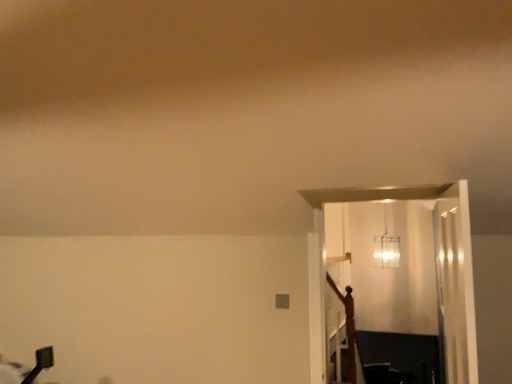
Question: Can we say wooden crucifix at right lies outside clear glass door at right?

Choices:
 (A) yes
 (B) no

Answer: (A)

Question: From a real-world perspective, is wooden crucifix at right beneath clear glass door at right?

Choices:
 (A) no
 (B) yes

Answer: (B)

Question: Can you confirm if wooden crucifix at right is taller than clear glass door at right?

Choices:
 (A) no
 (B) yes

Answer: (B)

Question: Does wooden crucifix at right have a smaller size compared to clear glass door at right?

Choices:
 (A) no
 (B) yes

Answer: (B)

Question: From a real-world perspective, is wooden crucifix at right positioned over clear glass door at right based on gravity?

Choices:
 (A) no
 (B) yes

Answer: (A)

Question: Is wooden crucifix at right far away from clear glass door at right?

Choices:
 (A) yes
 (B) no

Answer: (B)

Question: Does wooden crucifix at right appear on the right side of translucent glass pendant light at upper center?

Choices:
 (A) no
 (B) yes

Answer: (A)

Question: From a real-world perspective, does wooden crucifix at right stand above translucent glass pendant light at upper center?

Choices:
 (A) no
 (B) yes

Answer: (A)

Question: Is wooden crucifix at right turned away from translucent glass pendant light at upper center?

Choices:
 (A) yes
 (B) no

Answer: (B)

Question: Is wooden crucifix at right wider than translucent glass pendant light at upper center?

Choices:
 (A) yes
 (B) no

Answer: (B)

Question: Does wooden crucifix at right have a smaller size compared to translucent glass pendant light at upper center?

Choices:
 (A) no
 (B) yes

Answer: (B)

Question: Can translucent glass pendant light at upper center be found inside wooden crucifix at right?

Choices:
 (A) no
 (B) yes

Answer: (A)

Question: Considering the relative sizes of clear glass door at right and translucent glass pendant light at upper center in the image provided, is clear glass door at right wider than translucent glass pendant light at upper center?

Choices:
 (A) yes
 (B) no

Answer: (B)